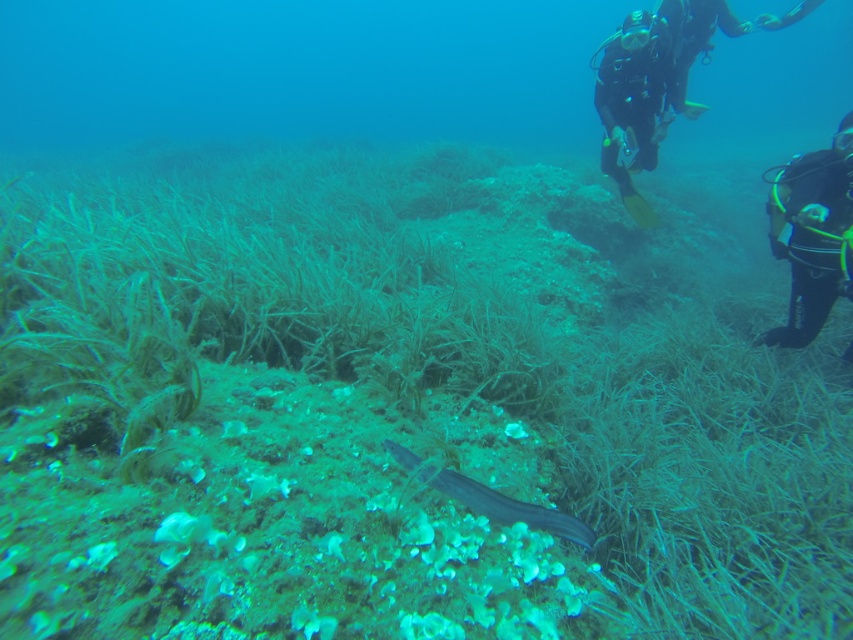
Question: In this image, where is black neoprene wetsuit at right located relative to smooth grayish-blue fish at center?

Choices:
 (A) below
 (B) above

Answer: (B)

Question: Is black neoprene wetsuit at right to the right of smooth grayish-blue fish at center from the viewer's perspective?

Choices:
 (A) yes
 (B) no

Answer: (A)

Question: Which object appears closest to the camera in this image?

Choices:
 (A) black neoprene wetsuit at right
 (B) smooth grayish-blue fish at center

Answer: (B)

Question: In this image, where is black neoprene wetsuit at right located relative to smooth grayish-blue fish at center?

Choices:
 (A) below
 (B) above

Answer: (B)

Question: Which point is farther from the camera taking this photo?

Choices:
 (A) (793, 186)
 (B) (502, 506)

Answer: (A)